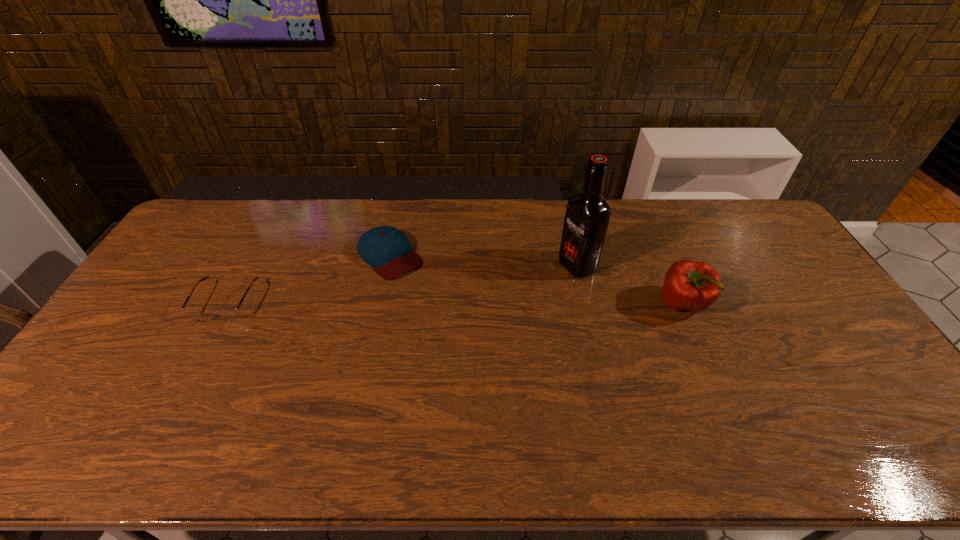
Where is `the leftmost object`? the leftmost object is located at coordinates (226, 314).

This screenshot has height=540, width=960. In order to click on spectacles in this screenshot , I will do `click(226, 314)`.

The width and height of the screenshot is (960, 540). Identify the location of the rightmost object. (693, 286).

This screenshot has width=960, height=540. In order to click on the second tallest object in this screenshot , I will do `click(693, 286)`.

Locate an element on the screen. the tallest object is located at coordinates (587, 216).

Locate an element on the screen. The width and height of the screenshot is (960, 540). liquor is located at coordinates (587, 216).

Where is `the second object from left to right`? The image size is (960, 540). the second object from left to right is located at coordinates (387, 250).

Where is `baseball cap`? The height and width of the screenshot is (540, 960). baseball cap is located at coordinates (387, 250).

The image size is (960, 540). I want to click on free spot located on the front-facing side of the leftmost object, so pos(204,340).

Identify the location of free space located on the left of the third shortest object. The image size is (960, 540). (604, 303).